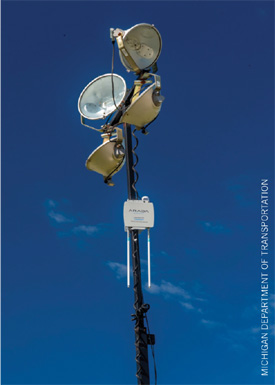
What are the coordinates of `right side of  lightig source` in the screenshot? It's located at coord(227,167).